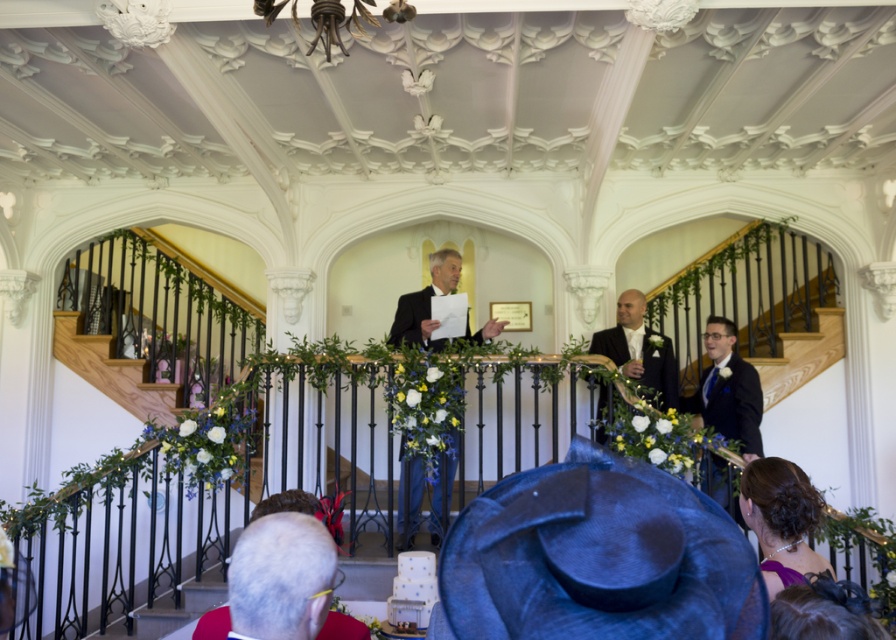
Question: Which point appears closest to the camera in this image?

Choices:
 (A) coord(315,602)
 (B) coord(445,250)

Answer: (A)

Question: Among these points, which one is farthest from the camera?

Choices:
 (A) (643, 374)
 (B) (720, 385)
 (C) (773, 502)
 (D) (440, 490)

Answer: (A)

Question: Is gray matte hair at lower left below purple satin dress at lower right?

Choices:
 (A) yes
 (B) no

Answer: (B)

Question: Is gray matte hair at lower left to the right of matte black suit at right from the viewer's perspective?

Choices:
 (A) no
 (B) yes

Answer: (A)

Question: Among these points, which one is farthest from the camera?

Choices:
 (A) (268, 525)
 (B) (590, 348)

Answer: (B)

Question: From the image, what is the correct spatial relationship of matte black suit at right in relation to black satin suit at center?

Choices:
 (A) below
 (B) above

Answer: (A)